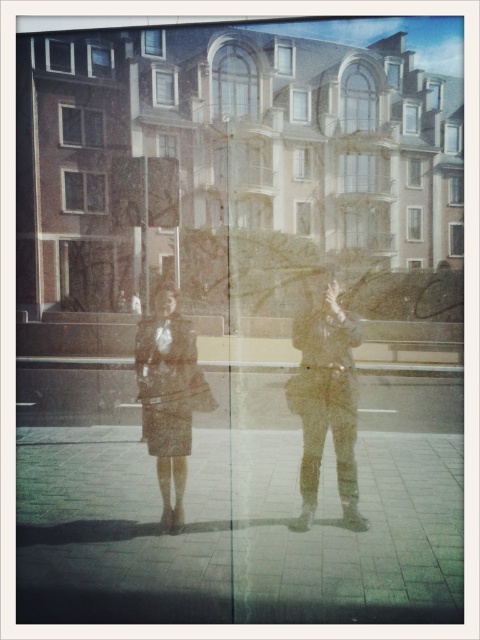
Question: Which of the following is the farthest from the observer?

Choices:
 (A) (186, 403)
 (B) (314, 394)
 (C) (313, 369)

Answer: (A)

Question: Where is smooth concrete pavement at lower center located in relation to matte brown coat at center in the image?

Choices:
 (A) below
 (B) above

Answer: (A)

Question: Which point is closer to the camera?

Choices:
 (A) (265, 579)
 (B) (345, 413)

Answer: (A)

Question: Does smooth concrete pavement at lower center have a greater width compared to matte brown coat at center?

Choices:
 (A) yes
 (B) no

Answer: (A)

Question: Which object appears farthest from the camera in this image?

Choices:
 (A) matte black jacket at center
 (B) matte brown coat at center

Answer: (B)

Question: Is matte black coat at center above matte brown coat at center?

Choices:
 (A) yes
 (B) no

Answer: (A)